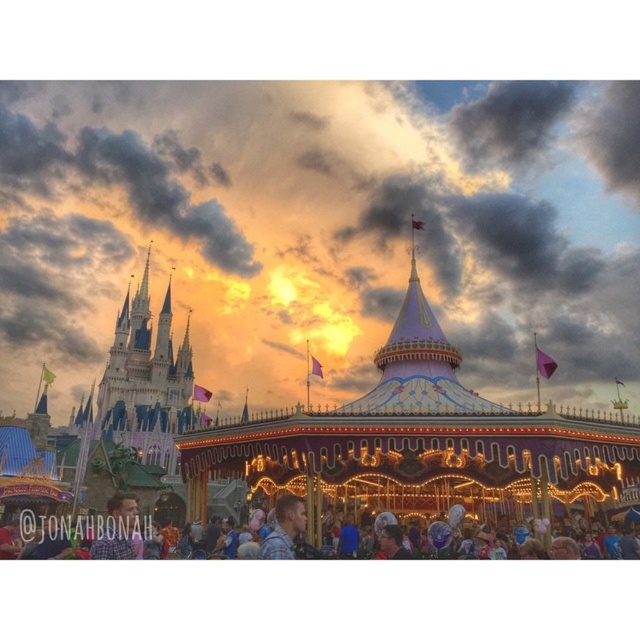
You are standing at the entrance of the theme park and want to locate the shiny metallic carousel at center. According to the coordinates provided, in which direction should you walk from the entrance to reach it?

The shiny metallic carousel at center is located at coordinates point (314,438). Since the entrance is typically at the bottom left corner of the image, you should walk towards the upper right direction to reach the carousel.

You are a theme park visitor who wants to take a photo of the shiny metallic carousel at center and the blue plaid shirt at lower center together in the frame. Considering their heights, which object should you focus on first to ensure both are fully visible in your photo?

The shiny metallic carousel at center is taller than the blue plaid shirt at lower center. To ensure both are fully visible in the photo, focus on the shiny metallic carousel at center first as it requires more vertical space.

You are standing at the base of the castle and want to take a photo of the carousel. There are two points marked in the scene, point A at coordinates point (593, 490) and point B at coordinates point (291, 557). Which point should you stand at to get a clearer view of the carousel?

You should stand at point A at coordinates point (593, 490) because it is closer to the camera, providing a clearer view of the carousel compared to point B, which is further away.